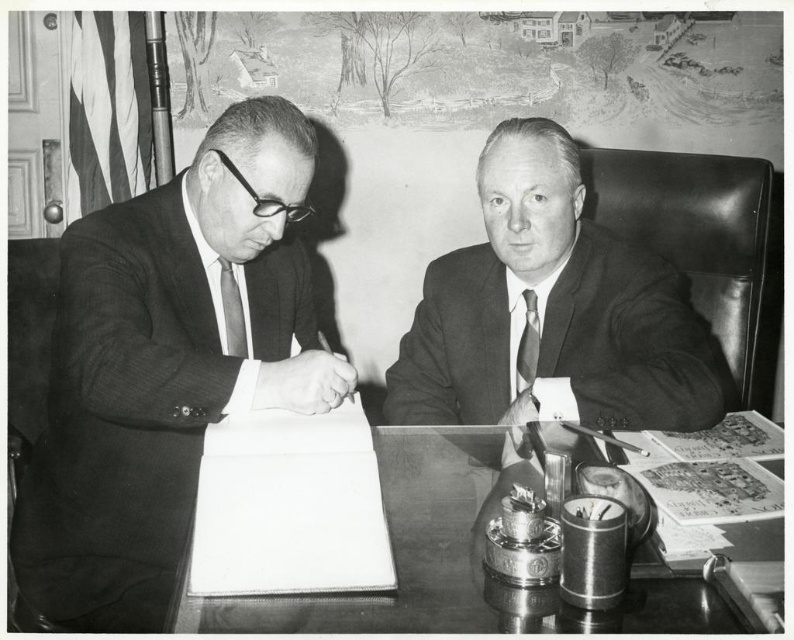
Question: Does smooth suit jacket at left have a greater width compared to shiny metal desk at center?

Choices:
 (A) yes
 (B) no

Answer: (B)

Question: Observing the image, what is the correct spatial positioning of shiny metal desk at center in reference to striped fabric tie at center?

Choices:
 (A) right
 (B) left

Answer: (B)

Question: Which of these objects is positioned farthest from the striped fabric tie at center?

Choices:
 (A) striped fabric tie at left
 (B) smooth suit jacket at left

Answer: (B)

Question: Which object is positioned farthest from the striped fabric tie at center?

Choices:
 (A) shiny metal desk at center
 (B) striped fabric tie at left
 (C) smooth suit jacket at left
 (D) smooth black suit at center

Answer: (C)

Question: Is smooth black suit at center positioned at the back of shiny metal desk at center?

Choices:
 (A) yes
 (B) no

Answer: (A)

Question: Which object is positioned farthest from the smooth black suit at center?

Choices:
 (A) striped fabric tie at left
 (B) shiny metal desk at center
 (C) striped fabric tie at center
 (D) smooth suit jacket at left

Answer: (A)